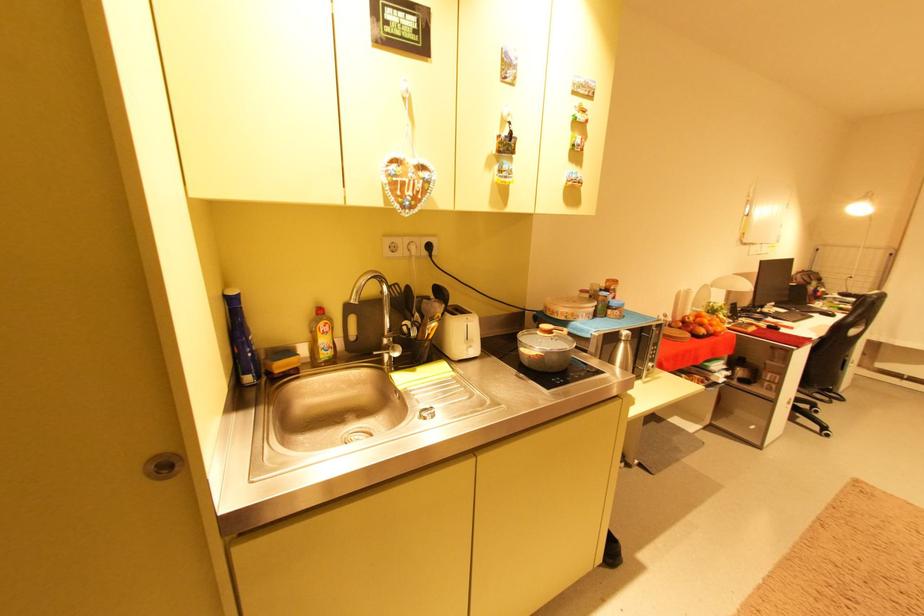
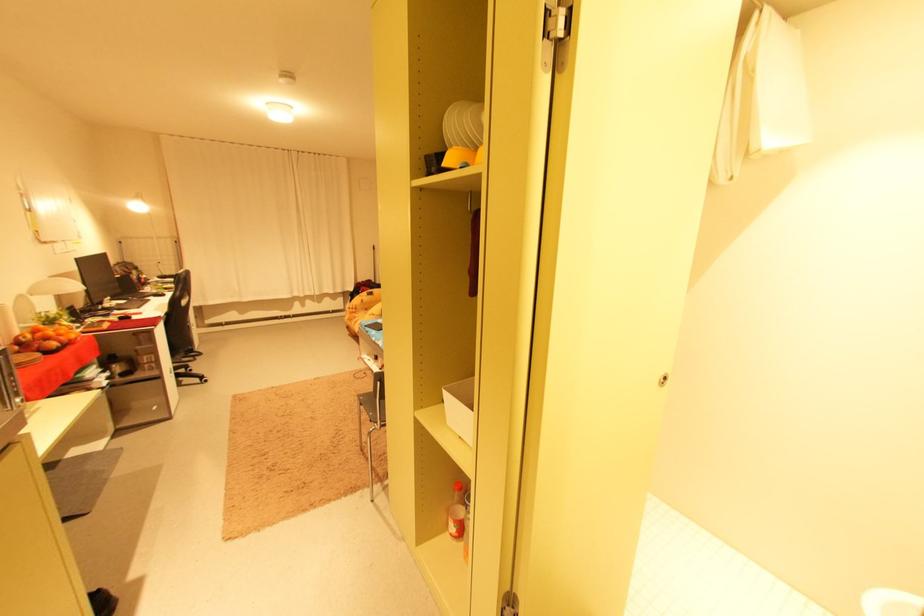
Question: I am providing you with two images of the same scene from different viewpoints. Please identify which objects are invisible in image2.

Choices:
 (A) white plate
 (B) silver cabinet lock
 (C) white storage box
 (D) none of these

Answer: (D)